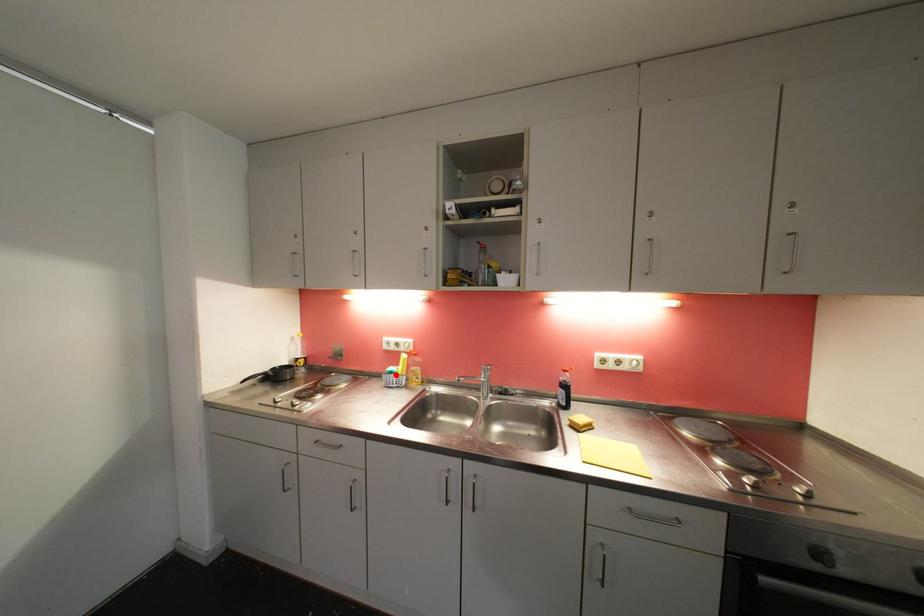
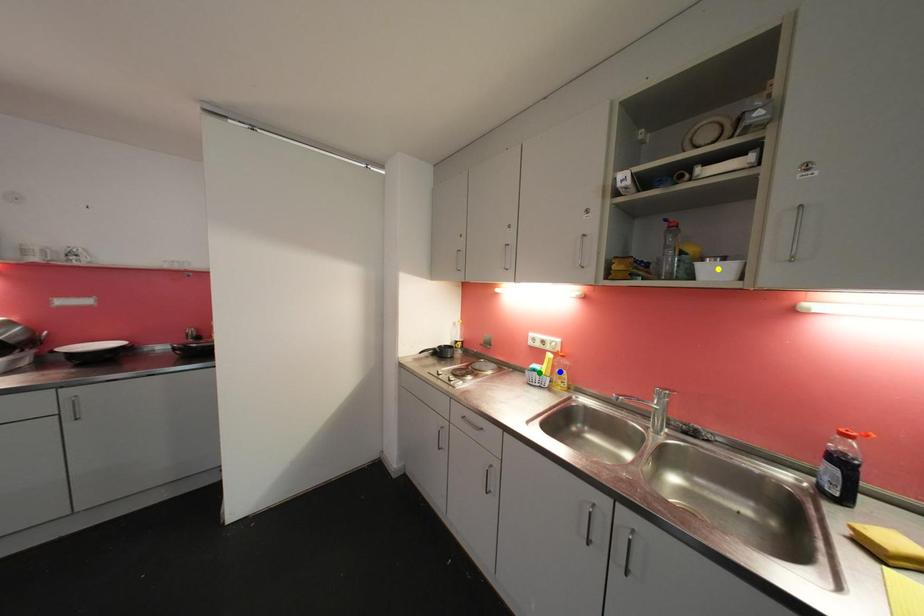
Question: I am providing you with two images of the same scene from different viewpoints. A red point is marked on the first image. You are given multiple points on the second image. Which spot in image 2 lines up with the point in image 1?

Choices:
 (A) blue point
 (B) green point
 (C) yellow point

Answer: (B)